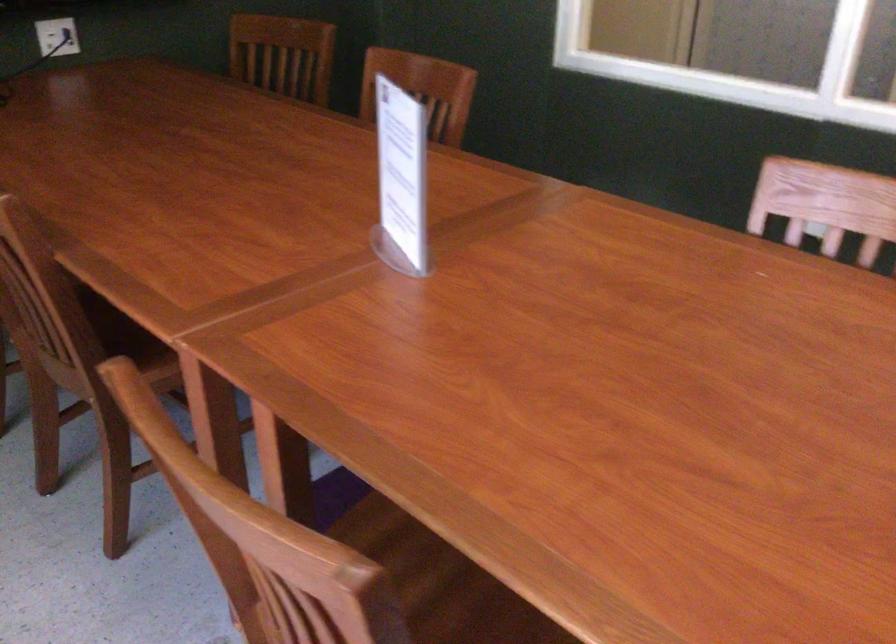
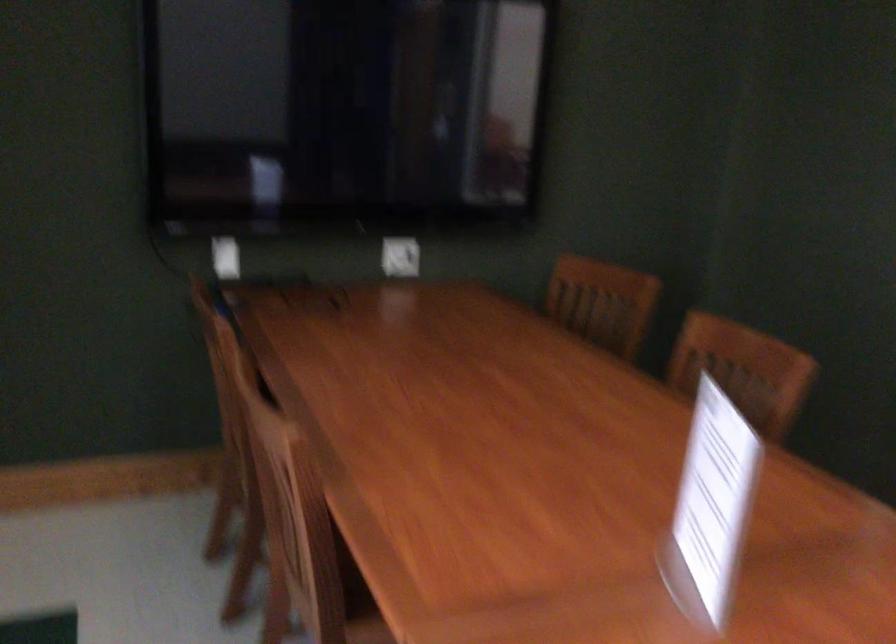
Question: The camera is either moving clockwise (left) or counter-clockwise (right) around the object. The first image is from the beginning of the video and the second image is from the end. Is the camera moving left or right when shooting the video?

Choices:
 (A) Left
 (B) Right

Answer: (B)